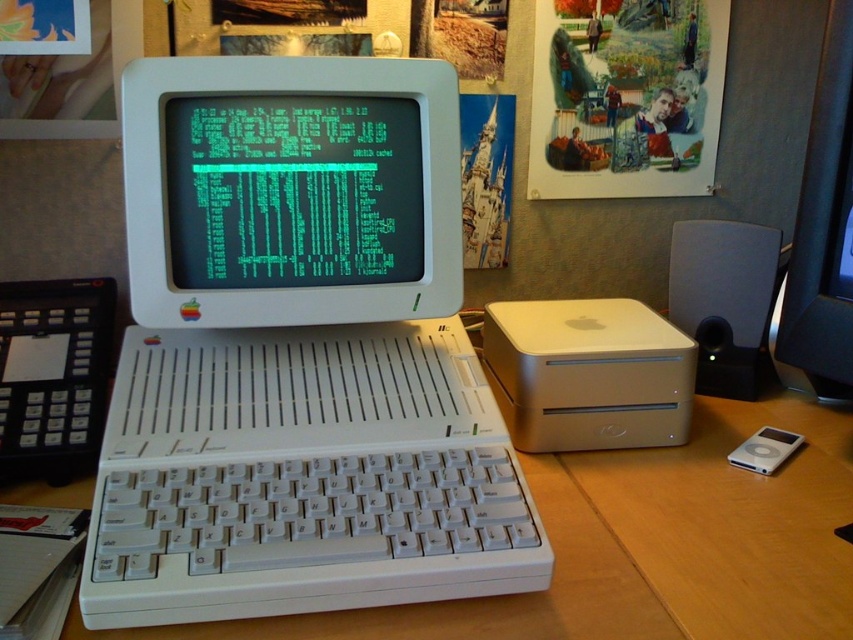
You are setting up a new desk arrangement and need to place the white plastic computer at center and the white plastic monitor at center. Based on the scene, which object is positioned lower on the desk?

The white plastic computer at center is positioned below the white plastic monitor at center, so it is lower on the desk.

Based on the scene description, can you determine if the white plastic monitor at center is positioned higher than the matte black speaker at right?

Yes, the white plastic monitor at center is located above the matte black speaker at right, so it is positioned higher.

You are setting up a new desk arrangement and want to place a tall plant between the white plastic computer at center and the white plastic monitor at center. Based on their heights, which object should the plant be placed closer to?

The white plastic computer at center is much taller than the white plastic monitor at center, so the plant should be placed closer to the white plastic monitor at center to balance the height difference.